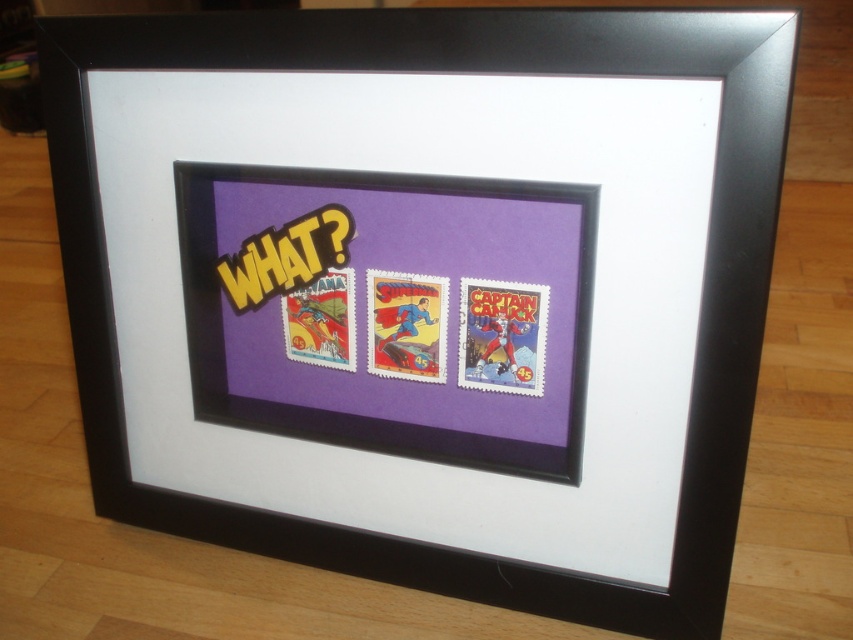
How far apart are the matte purple stamp at center and the other two stamps?

The matte purple stamp at center and the other two stamps are 33.16 inches apart.

You are designing a stamp collection layout for a display. You have two stamps, the matte purple stamp at center and the bright red paper stamp at center. Which stamp should you choose if you want to place a larger stamp in the center of the display?

The matte purple stamp at center is bigger than the bright red paper stamp at center, so you should choose the matte purple stamp at center for the center of the display.